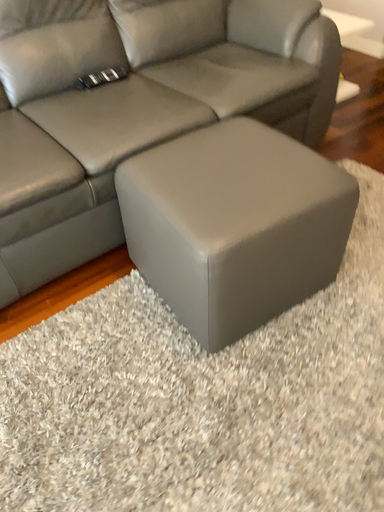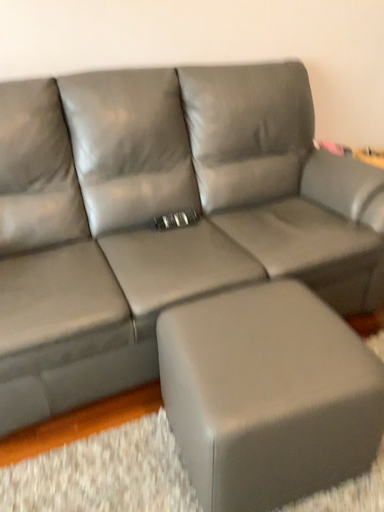
Question: How did the camera likely rotate when shooting the video?

Choices:
 (A) rotated left
 (B) rotated right

Answer: (A)